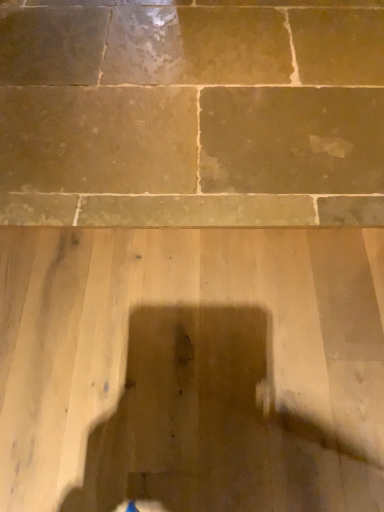
What do you see at coordinates (192, 115) in the screenshot? I see `smooth stone wall at upper center` at bounding box center [192, 115].

The width and height of the screenshot is (384, 512). Identify the location of smooth stone wall at upper center. (192, 115).

This screenshot has width=384, height=512. Find the location of `smooth stone wall at upper center`. smooth stone wall at upper center is located at coordinates (192, 115).